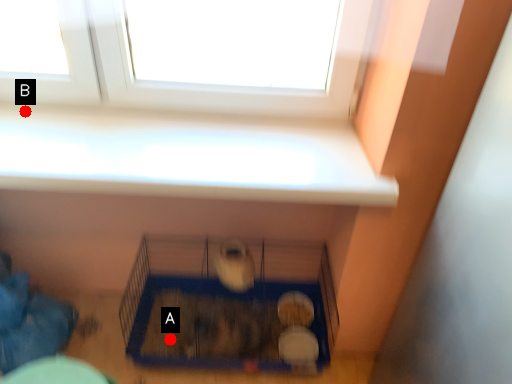
Question: Two points are circled on the image, labeled by A and B beside each circle. Among these points, which one is farthest from the camera?

Choices:
 (A) A is further
 (B) B is further

Answer: (A)